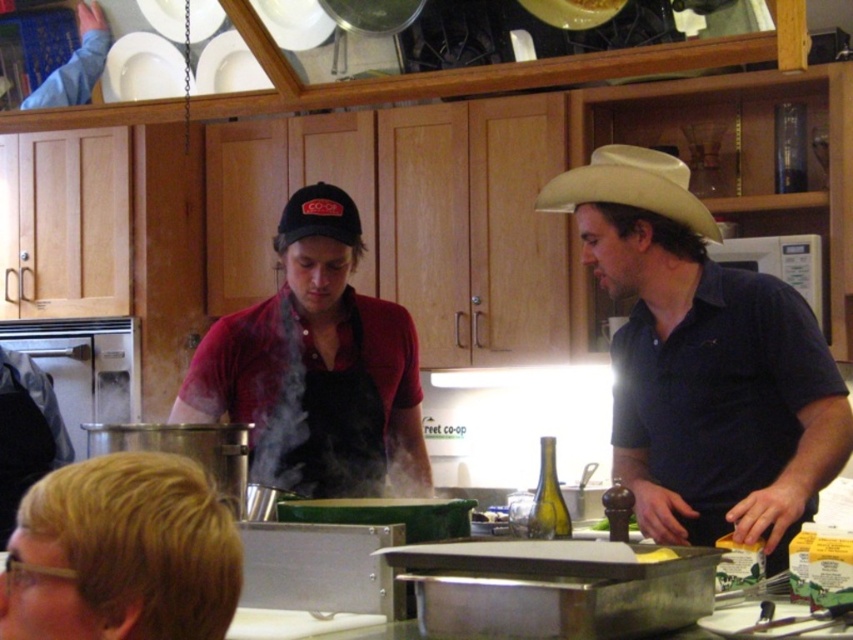
At what (x,y) coordinates should I click in order to perform the action: click on beige felt cowboy hat at upper right. Please return your answer as a coordinate pair (x, y). Looking at the image, I should click on (631, 188).

Is beige felt cowboy hat at upper right smaller than black fabric baseball cap at center?

Incorrect, beige felt cowboy hat at upper right is not smaller in size than black fabric baseball cap at center.

This screenshot has height=640, width=853. I want to click on beige felt cowboy hat at upper right, so click(x=631, y=188).

Between point (631, 449) and point (135, 70), which one is positioned in front?

Point (631, 449) is in front.

Looking at this image, which is more to the right, dark blue shirt at center or white matte plate at upper left?

dark blue shirt at center

Who is more distant from viewer, (763, 499) or (151, 58)?

Point (151, 58)

I want to click on dark blue shirt at center, so click(703, 364).

Is dark blue shirt at center bigger than beige felt cowboy hat at upper right?

Yes.

Does dark blue shirt at center have a lesser height compared to beige felt cowboy hat at upper right?

No.

You are a GUI agent. You are given a task and a screenshot of the screen. Output one action in this format:
    pyautogui.click(x=<x>, y=<y>)
    Task: Click on the dark blue shirt at center
    This screenshot has width=853, height=640.
    Given the screenshot: What is the action you would take?
    pos(703,364)